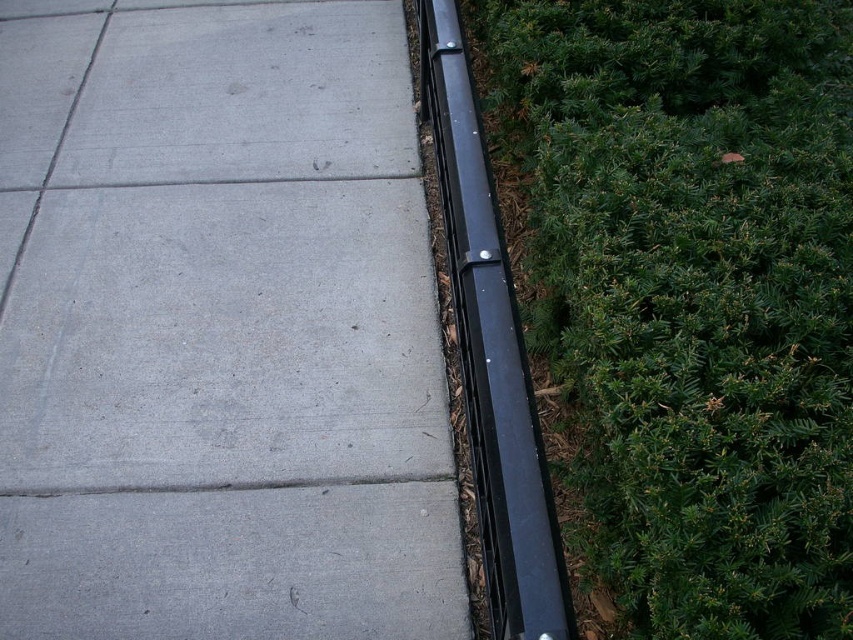
Looking at this image, between gray concrete pavement at center and green leafy hedge at right, which one is positioned higher?

gray concrete pavement at center is higher up.

Which is more to the left, gray concrete pavement at center or green leafy hedge at right?

gray concrete pavement at center

Which is in front, point (350, 216) or point (631, 113)?

Point (631, 113)

Find the location of a particular element. gray concrete pavement at center is located at coordinates (219, 332).

Does green leafy hedge at right lie in front of black metal curb at right?

That is False.

Between green leafy hedge at right and black metal curb at right, which one is positioned lower?

Positioned lower is black metal curb at right.

This screenshot has width=853, height=640. What do you see at coordinates (689, 292) in the screenshot?
I see `green leafy hedge at right` at bounding box center [689, 292].

I want to click on green leafy hedge at right, so click(x=689, y=292).

Looking at this image, is gray concrete pavement at center above black metal curb at right?

Indeed, gray concrete pavement at center is positioned over black metal curb at right.

Does gray concrete pavement at center lie in front of black metal curb at right?

No, gray concrete pavement at center is behind black metal curb at right.

Who is more forward, (155, 460) or (456, 77)?

Point (456, 77)

Identify the location of gray concrete pavement at center. (219, 332).